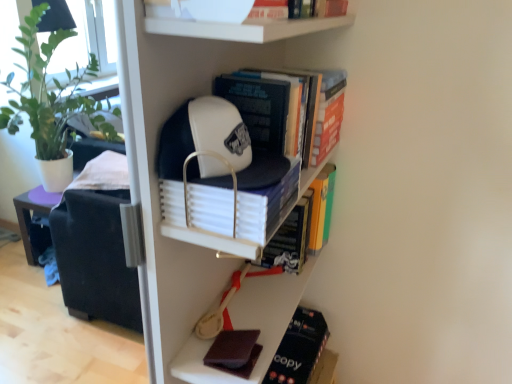
Question: Would you consider orange matte book at upper right, positioned as the fifth book in bottom-to-top order, to be distant from white matte baseball cap at upper center?

Choices:
 (A) no
 (B) yes

Answer: (A)

Question: Is orange matte book at upper right, the 2th book when ordered from top to bottom, thinner than white matte baseball cap at upper center?

Choices:
 (A) no
 (B) yes

Answer: (B)

Question: Is orange matte book at upper right, the 2th book when ordered from top to bottom, to the right of white matte baseball cap at upper center from the viewer's perspective?

Choices:
 (A) no
 (B) yes

Answer: (B)

Question: Is orange matte book at upper right, the 2th book when ordered from top to bottom, surrounding white matte baseball cap at upper center?

Choices:
 (A) yes
 (B) no

Answer: (B)

Question: Does orange matte book at upper right, positioned as the fifth book in bottom-to-top order, lie in front of white matte baseball cap at upper center?

Choices:
 (A) yes
 (B) no

Answer: (B)

Question: Does orange matte book at upper right, positioned as the fifth book in bottom-to-top order, come behind white matte baseball cap at upper center?

Choices:
 (A) yes
 (B) no

Answer: (A)

Question: Would you consider orange matte book at upper right, the 2th book when ordered from top to bottom, to be distant from white matte bowl at upper center, acting as the 6th book starting from the bottom?

Choices:
 (A) no
 (B) yes

Answer: (A)

Question: Considering the relative sizes of orange matte book at upper right, the 2th book when ordered from top to bottom, and white matte bowl at upper center, acting as the 6th book starting from the bottom, in the image provided, is orange matte book at upper right, the 2th book when ordered from top to bottom, wider than white matte bowl at upper center, acting as the 6th book starting from the bottom,?

Choices:
 (A) no
 (B) yes

Answer: (B)

Question: Is orange matte book at upper right, the 2th book when ordered from top to bottom, to the left of white matte bowl at upper center, acting as the 6th book starting from the bottom, from the viewer's perspective?

Choices:
 (A) no
 (B) yes

Answer: (A)

Question: From the image's perspective, would you say orange matte book at upper right, the 2th book when ordered from top to bottom, is positioned over white matte bowl at upper center, acting as the 6th book starting from the bottom?

Choices:
 (A) no
 (B) yes

Answer: (A)

Question: From a real-world perspective, does orange matte book at upper right, the 2th book when ordered from top to bottom, stand above white matte bowl at upper center, the 1th book viewed from the top?

Choices:
 (A) no
 (B) yes

Answer: (A)

Question: Considering the relative sizes of orange matte book at upper right, the 2th book when ordered from top to bottom, and white matte bowl at upper center, acting as the 6th book starting from the bottom, in the image provided, is orange matte book at upper right, the 2th book when ordered from top to bottom, shorter than white matte bowl at upper center, acting as the 6th book starting from the bottom,?

Choices:
 (A) yes
 (B) no

Answer: (B)

Question: Does hardcover book at center, which is the third book from top to bottom, have a greater height compared to white matte book at center, positioned as the 4th book in top-to-bottom order?

Choices:
 (A) yes
 (B) no

Answer: (A)